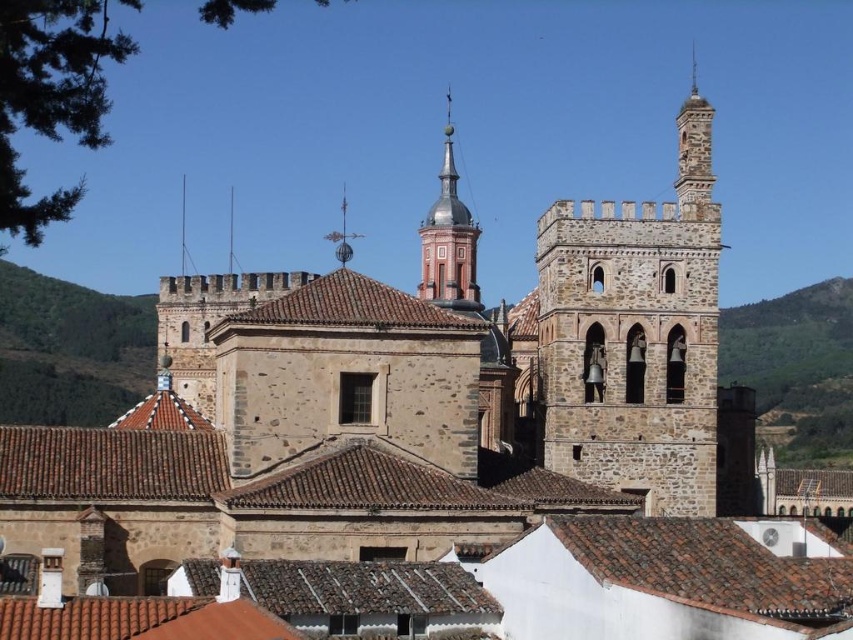
You are standing at the entrance of the historic stone building and notice a point marked at coordinates (450, 241). Which architectural feature does this point correspond to?

The point at coordinates (450, 241) corresponds to the smooth red brick tower at center.